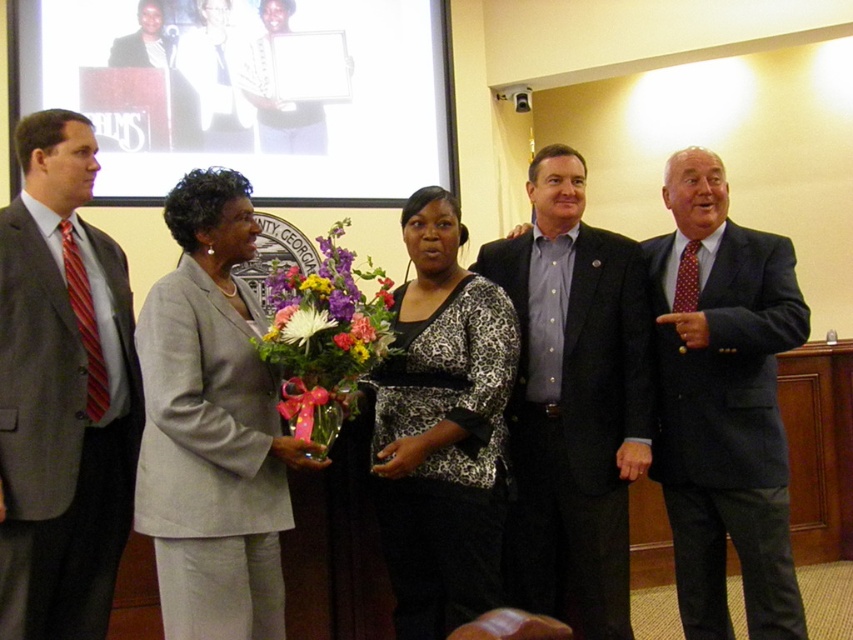
You are organizing a photo shoot and need to arrange two people wearing the gray suit at left and the light gray suit at center. Based on their clothing widths, which person should stand closer to the camera to ensure both appear equally wide in the photo?

The gray suit at left has a lesser width compared to the light gray suit at center. To make them appear equally wide in the photo, the person in the gray suit at left should stand closer to the camera than the person in the light gray suit at center.

You are a photographer at the event and need to adjust the camera focus. The gray suit at left and the light gray suit at center are in your frame. Which person should you focus on first if you want to capture someone closer to the camera?

The gray suit at left is taller than the light gray suit at center, so focusing on the gray suit at left first would be better as taller individuals are typically closer to the camera.

You are attending this event and need to take a photo of both the gray suit at left and the dark blue suit at right. Based on their positions, which one should you focus on first to ensure both are in the frame?

The gray suit at left is in front of the dark blue suit at right, so you should focus on the dark blue suit at right first to ensure both are in the frame.